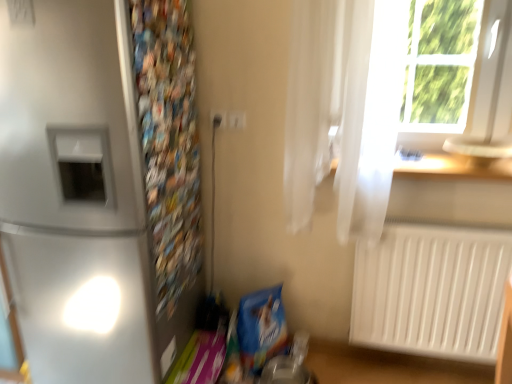
Question: From a real-world perspective, is white plastic electric outlet at upper center, marked as the 2th electric outlet in a left-to-right arrangement, physically located above or below satin silver refrigerator at left?

Choices:
 (A) below
 (B) above

Answer: (B)

Question: Considering their positions, is white plastic electric outlet at upper center, which is counted as the first electric outlet, starting from the right, located in front of or behind satin silver refrigerator at left?

Choices:
 (A) behind
 (B) front

Answer: (A)

Question: Which of these objects is positioned farthest from the multicolored paper at left?

Choices:
 (A) white plastic electric outlet at upper center, which is counted as the first electric outlet, starting from the right
 (B) satin silver refrigerator at left
 (C) white plastic window frame at upper right
 (D) wooden at upper right
 (E) white plastic electric outlet at center, the 1th electric outlet positioned from the left

Answer: (C)

Question: Considering the real-world distances, which object is farthest from the white plastic window frame at upper right?

Choices:
 (A) white plastic radiator at lower right
 (B) wooden at upper right
 (C) white plastic electric outlet at upper center, which is counted as the first electric outlet, starting from the right
 (D) white sheer curtain at upper right
 (E) multicolored paper at left

Answer: (E)